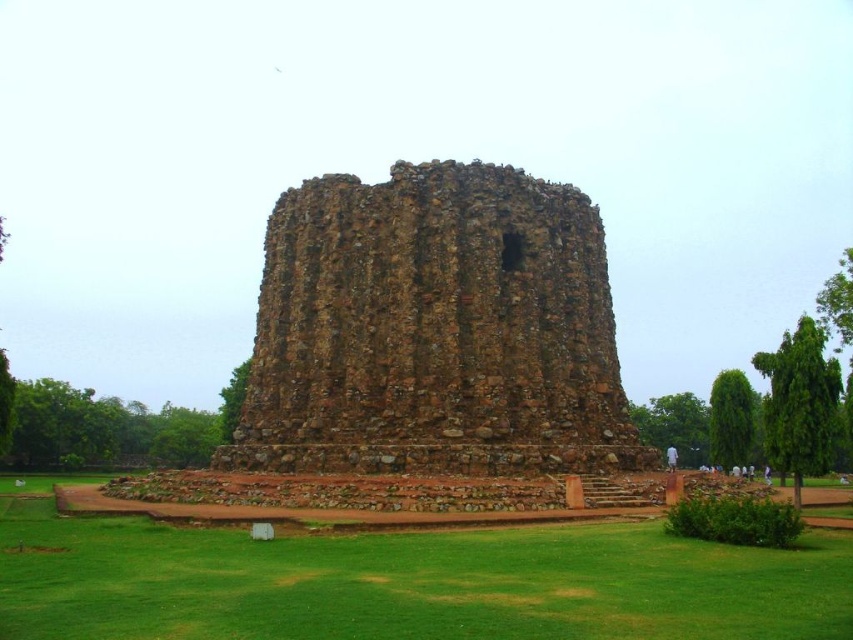
Question: Is brown stone ruins at center bigger than green grass at center?

Choices:
 (A) yes
 (B) no

Answer: (A)

Question: Does brown stone ruins at center have a lesser width compared to green grass at center?

Choices:
 (A) no
 (B) yes

Answer: (B)

Question: Which object appears farthest from the camera in this image?

Choices:
 (A) green grass at center
 (B) brown stone ruins at center

Answer: (B)

Question: Is the position of brown stone ruins at center more distant than that of green grass at center?

Choices:
 (A) no
 (B) yes

Answer: (B)